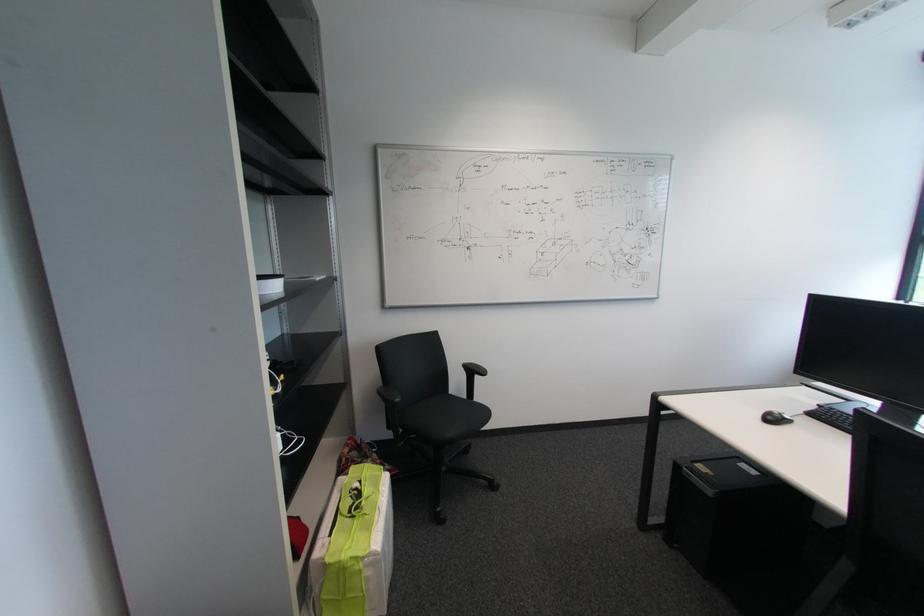
Locate an element on the screen. Image resolution: width=924 pixels, height=616 pixels. green fabric bag is located at coordinates (350, 541).